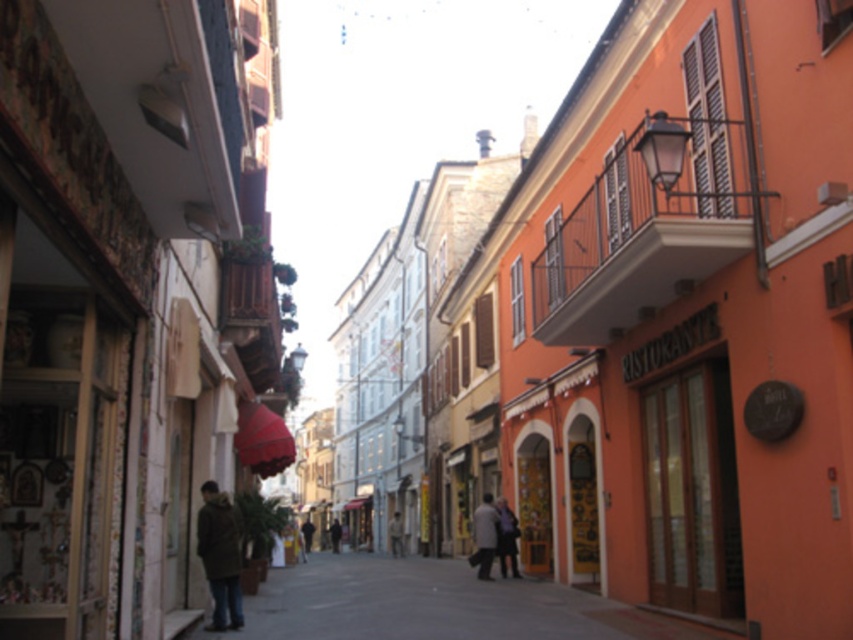
Question: Can you confirm if light gray fabric coat at center is bigger than dark blue jeans at center?

Choices:
 (A) no
 (B) yes

Answer: (A)

Question: Does dark green textured coat at lower left have a lesser width compared to light brown leather jacket at center?

Choices:
 (A) no
 (B) yes

Answer: (A)

Question: Which object appears closest to the camera in this image?

Choices:
 (A) dark green textured coat at lower left
 (B) smooth concrete pavement at center

Answer: (B)

Question: Which point is closer to the camera?

Choices:
 (A) light gray fabric coat at center
 (B) dark gray coat at center
 (C) smooth concrete pavement at center

Answer: (C)

Question: Which is nearer to the dark green textured coat at lower left?

Choices:
 (A) light gray fabric coat at center
 (B) dark gray coat at center

Answer: (A)

Question: Is dark green textured coat at lower left behind light brown leather jacket at center?

Choices:
 (A) no
 (B) yes

Answer: (A)